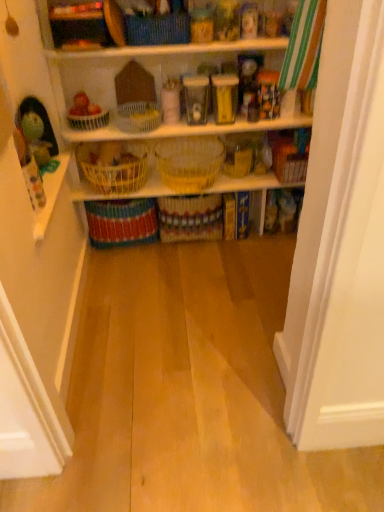
Identify the location of blank space situated above yellow wicker baskets at center (from a real-world perspective). (207, 176).